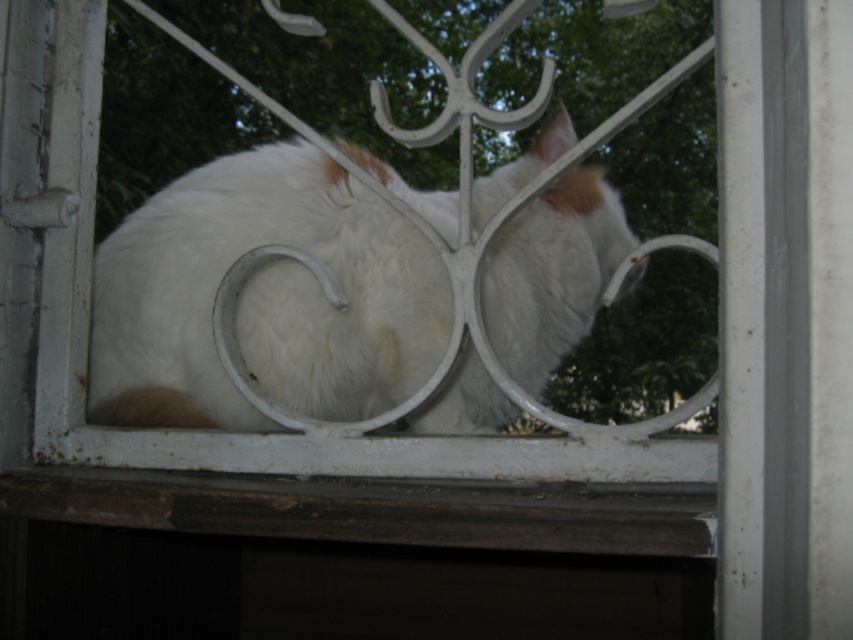
Question: Which point is closer to the camera?

Choices:
 (A) (589, 276)
 (B) (28, 467)

Answer: (B)

Question: Is white fluffy cat at center thinner than brown wood at bottom?

Choices:
 (A) no
 (B) yes

Answer: (A)

Question: Considering the relative positions of white fluffy cat at center and brown wood at bottom in the image provided, where is white fluffy cat at center located with respect to brown wood at bottom?

Choices:
 (A) above
 (B) below

Answer: (A)

Question: Does white fluffy cat at center have a greater width compared to brown wood at bottom?

Choices:
 (A) yes
 (B) no

Answer: (A)